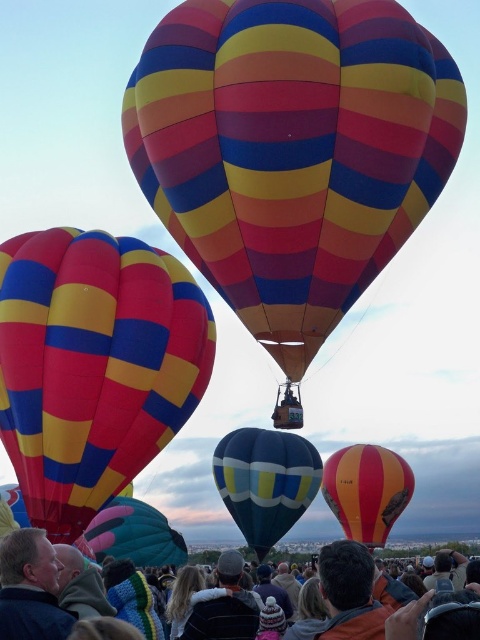
Question: Which point is farther to the camera?

Choices:
 (A) (141, 506)
 (B) (199, 616)
 (C) (387, 509)

Answer: (C)

Question: Does matte striped balloon at left appear on the right side of multicolored fabric crowd at lower center?

Choices:
 (A) yes
 (B) no

Answer: (B)

Question: Can you confirm if multicolored striped hot air balloon at center is positioned above matte multicolored balloon at center?

Choices:
 (A) no
 (B) yes

Answer: (B)

Question: Does smooth beige jacket at lower left come in front of matte multicolored balloon at center?

Choices:
 (A) yes
 (B) no

Answer: (A)

Question: Among these objects, which one is nearest to the camera?

Choices:
 (A) matte multicolored balloon at center
 (B) blue glossy balloon at center

Answer: (A)

Question: Among these objects, which one is nearest to the camera?

Choices:
 (A) blue glossy balloon at center
 (B) multicolored fabric crowd at lower center

Answer: (B)